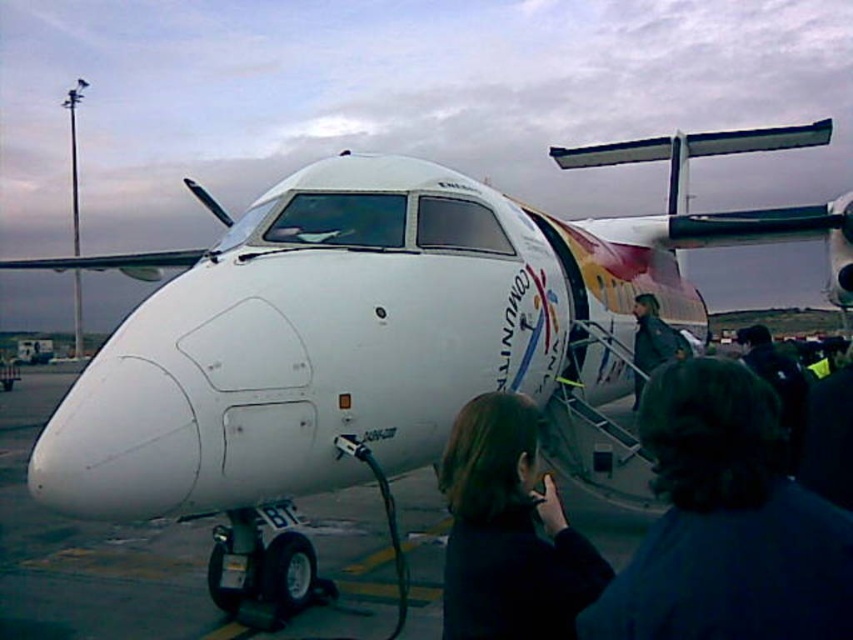
You are standing at the point marked by point (653, 352). You want to walk towards the aircraft. Is the point marked by point (553, 570) between you and the aircraft?

Yes, the point marked by point (553, 570) is between you and the aircraft because it is in front of point (653, 352), which is your current position.

You are standing at the airport gate where the small regional aircraft is parked. You notice two points marked on the ground near the plane. The first point is at coordinates point (660, 476) and the second point is at point (660, 320). From your perspective facing the aircraft, which point is closer to the front of the plane?

Point (660, 476) is in front of point (660, 320), so the first point is closer to the front of the aircraft.

You are a passenger waiting to board the aircraft and see two people nearby, one with dark brown hair at lower center and another wearing a dark blue jacket at center. Which person is closer to the left side of the aircraft?

The dark brown hair at lower center is positioned on the left side of dark blue jacket at center, so the dark brown hair at lower center is closer to the left side of the aircraft.